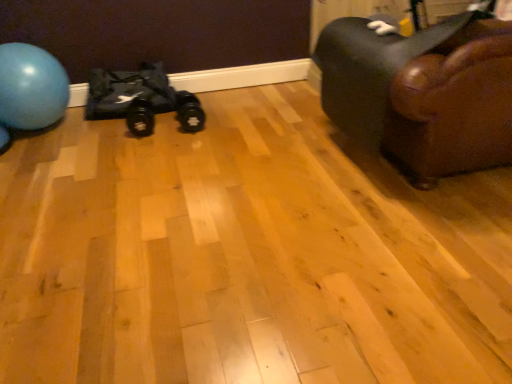
Identify the location of black rubber dumbbell at center, the second footwear from the left. This screenshot has width=512, height=384. (189, 112).

The height and width of the screenshot is (384, 512). Describe the element at coordinates (31, 87) in the screenshot. I see `blue rubber ball at left` at that location.

What do you see at coordinates (422, 93) in the screenshot? This screenshot has width=512, height=384. I see `brown leather couch at right` at bounding box center [422, 93].

Find the location of `black rubber dumbbell at center, marked as the first footwear in a left-to-right arrangement`. black rubber dumbbell at center, marked as the first footwear in a left-to-right arrangement is located at coordinates (140, 121).

The width and height of the screenshot is (512, 384). Describe the element at coordinates (140, 121) in the screenshot. I see `black rubber dumbbell at center, marked as the first footwear in a left-to-right arrangement` at that location.

Find the location of a particular element. The height and width of the screenshot is (384, 512). black rubber dumbbell at center, which is the 1th footwear from right to left is located at coordinates (189, 112).

Is blue rubber ball at left situated inside black rubber dumbbell at center, which is the 1th footwear from right to left, or outside?

blue rubber ball at left is outside black rubber dumbbell at center, which is the 1th footwear from right to left.

Find the location of a particular element. ball on the left of black rubber dumbbell at center, the second footwear from the left is located at coordinates (31, 87).

From a real-world perspective, between blue rubber ball at left and black rubber dumbbell at center, which is the 1th footwear from right to left, who is vertically lower?

From a 3D spatial view, black rubber dumbbell at center, which is the 1th footwear from right to left, is below.

Considering the relative sizes of black rubber dumbbell at center, arranged as the second footwear when viewed from the right, and black rubber dumbbell at center, the second footwear from the left, in the image provided, is black rubber dumbbell at center, arranged as the second footwear when viewed from the right, thinner than black rubber dumbbell at center, the second footwear from the left,?

In fact, black rubber dumbbell at center, arranged as the second footwear when viewed from the right, might be wider than black rubber dumbbell at center, the second footwear from the left.

How different are the orientations of black rubber dumbbell at center, marked as the first footwear in a left-to-right arrangement, and black rubber dumbbell at center, which is the 1th footwear from right to left, in degrees?

They differ by 0.000125 degrees in their facing directions.

Could you tell me if black rubber dumbbell at center, marked as the first footwear in a left-to-right arrangement, is turned towards black rubber dumbbell at center, the second footwear from the left?

No, black rubber dumbbell at center, marked as the first footwear in a left-to-right arrangement, is not facing towards black rubber dumbbell at center, the second footwear from the left.

From their relative heights in the image, would you say black rubber dumbbell at center, arranged as the second footwear when viewed from the right, is taller or shorter than black rubber dumbbell at center, which is the 1th footwear from right to left?

black rubber dumbbell at center, arranged as the second footwear when viewed from the right, is shorter than black rubber dumbbell at center, which is the 1th footwear from right to left.

Is black rubber dumbbell at center, the second footwear from the left, inside black fabric bag at left?

No, black rubber dumbbell at center, the second footwear from the left, is located outside of black fabric bag at left.

From a real-world perspective, which footwear is the 1st one underneath the black fabric bag at left? Please provide its 2D coordinates.

[(189, 112)]

From a real-world perspective, which object stands above the other?

In real-world perspective, black fabric bag at left is above.

From the image's perspective, which is above, black fabric bag at left or black rubber dumbbell at center, the second footwear from the left?

black fabric bag at left is shown above in the image.

Is point (193, 122) closer to viewer compared to point (136, 132)?

No, (193, 122) is further to viewer.

Could you tell me if black rubber dumbbell at center, the second footwear from the left, is facing black rubber dumbbell at center, marked as the first footwear in a left-to-right arrangement?

No, black rubber dumbbell at center, the second footwear from the left, is not aimed at black rubber dumbbell at center, marked as the first footwear in a left-to-right arrangement.

In the scene shown: Is black rubber dumbbell at center, the second footwear from the left, taller than black rubber dumbbell at center, marked as the first footwear in a left-to-right arrangement?

Yes, black rubber dumbbell at center, the second footwear from the left, is taller than black rubber dumbbell at center, marked as the first footwear in a left-to-right arrangement.

Which object is thinner, black rubber dumbbell at center, the second footwear from the left, or black rubber dumbbell at center, arranged as the second footwear when viewed from the right?

Thinner between the two is black rubber dumbbell at center, the second footwear from the left.

Is black rubber dumbbell at center, arranged as the second footwear when viewed from the right, wider than brown leather couch at right?

No, black rubber dumbbell at center, arranged as the second footwear when viewed from the right, is not wider than brown leather couch at right.

From the image's perspective, is black rubber dumbbell at center, arranged as the second footwear when viewed from the right, under brown leather couch at right?

Indeed, from the image's perspective, black rubber dumbbell at center, arranged as the second footwear when viewed from the right, is shown beneath brown leather couch at right.

Does black rubber dumbbell at center, marked as the first footwear in a left-to-right arrangement, turn towards brown leather couch at right?

No, black rubber dumbbell at center, marked as the first footwear in a left-to-right arrangement, is not turned towards brown leather couch at right.

Based on the photo, is black rubber dumbbell at center, arranged as the second footwear when viewed from the right, not close to brown leather couch at right?

That's right, there is a large distance between black rubber dumbbell at center, arranged as the second footwear when viewed from the right, and brown leather couch at right.

Which is nearer, (187, 111) or (3, 115)?

Point (187, 111).

Considering the positions of objects black rubber dumbbell at center, the second footwear from the left, and blue rubber ball at left in the image provided, who is more to the right, black rubber dumbbell at center, the second footwear from the left, or blue rubber ball at left?

Positioned to the right is black rubber dumbbell at center, the second footwear from the left.

Does black rubber dumbbell at center, which is the 1th footwear from right to left, have a smaller size compared to blue rubber ball at left?

Correct, black rubber dumbbell at center, which is the 1th footwear from right to left, occupies less space than blue rubber ball at left.

Based on the photo, is black fabric bag at left oriented away from blue rubber ball at left?

No, black fabric bag at left is not facing away from blue rubber ball at left.

Considering their positions, is black fabric bag at left located in front of or behind blue rubber ball at left?

black fabric bag at left is behind blue rubber ball at left.

From the picture: From the image's perspective, does black fabric bag at left appear lower than blue rubber ball at left?

No, from the image's perspective, black fabric bag at left is not below blue rubber ball at left.

Where is `ball that is on the left side of black rubber dumbbell at center, the second footwear from the left`? The height and width of the screenshot is (384, 512). ball that is on the left side of black rubber dumbbell at center, the second footwear from the left is located at coordinates (31, 87).

Locate an element on the screen. footwear in front of the black rubber dumbbell at center, the second footwear from the left is located at coordinates (140, 121).

Considering their positions, is black rubber dumbbell at center, marked as the first footwear in a left-to-right arrangement, positioned further to blue rubber ball at left than black rubber dumbbell at center, which is the 1th footwear from right to left?

black rubber dumbbell at center, which is the 1th footwear from right to left, is positioned further to the anchor blue rubber ball at left.

Consider the image. Based on their spatial positions, is black rubber dumbbell at center, which is the 1th footwear from right to left, or black fabric bag at left closer to black rubber dumbbell at center, arranged as the second footwear when viewed from the right?

black fabric bag at left.

From the image, which object appears to be nearer to black rubber dumbbell at center, marked as the first footwear in a left-to-right arrangement, black fabric bag at left or brown leather couch at right?

black fabric bag at left lies closer to black rubber dumbbell at center, marked as the first footwear in a left-to-right arrangement, than the other object.

When comparing their distances from black fabric bag at left, does black rubber dumbbell at center, marked as the first footwear in a left-to-right arrangement, or blue rubber ball at left seem closer?

The object closer to black fabric bag at left is black rubber dumbbell at center, marked as the first footwear in a left-to-right arrangement.

Estimate the real-world distances between objects in this image. Which object is closer to black rubber dumbbell at center, the second footwear from the left, black rubber dumbbell at center, marked as the first footwear in a left-to-right arrangement, or black fabric bag at left?

Among the two, black fabric bag at left is located nearer to black rubber dumbbell at center, the second footwear from the left.

Consider the image. Based on their spatial positions, is black rubber dumbbell at center, marked as the first footwear in a left-to-right arrangement, or blue rubber ball at left further from black rubber dumbbell at center, which is the 1th footwear from right to left?

The object further to black rubber dumbbell at center, which is the 1th footwear from right to left, is blue rubber ball at left.

Based on their spatial positions, is black rubber dumbbell at center, marked as the first footwear in a left-to-right arrangement, or black fabric bag at left further from brown leather couch at right?

The object further to brown leather couch at right is black rubber dumbbell at center, marked as the first footwear in a left-to-right arrangement.

Considering their positions, is blue rubber ball at left positioned further to black rubber dumbbell at center, arranged as the second footwear when viewed from the right, than black rubber dumbbell at center, the second footwear from the left?

blue rubber ball at left lies further to black rubber dumbbell at center, arranged as the second footwear when viewed from the right, than the other object.

Locate an element on the screen. baby carriage between blue rubber ball at left and black rubber dumbbell at center, marked as the first footwear in a left-to-right arrangement, from left to right is located at coordinates (141, 99).

Where is `baby carriage located between blue rubber ball at left and brown leather couch at right in the left-right direction`? The width and height of the screenshot is (512, 384). baby carriage located between blue rubber ball at left and brown leather couch at right in the left-right direction is located at coordinates (141, 99).

Locate an element on the screen. footwear situated between black rubber dumbbell at center, arranged as the second footwear when viewed from the right, and brown leather couch at right from left to right is located at coordinates (189, 112).

This screenshot has height=384, width=512. I want to click on footwear between blue rubber ball at left and black rubber dumbbell at center, the second footwear from the left, so click(140, 121).